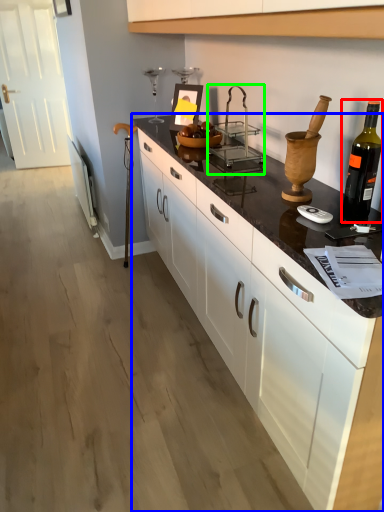
Question: Which object is positioned closest to bottle (highlighted by a red box)? Select from countertop (highlighted by a blue box) and appliance (highlighted by a green box).

Choices:
 (A) countertop
 (B) appliance

Answer: (A)